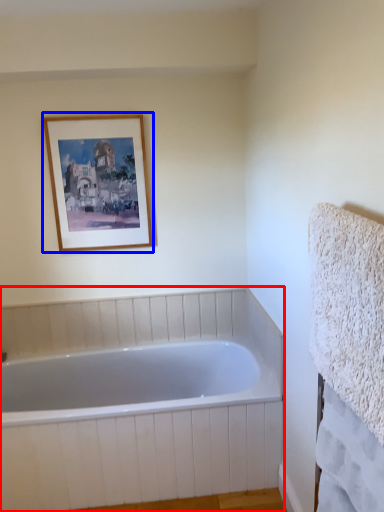
Question: Which object appears closest to the camera in this image, bathtub (highlighted by a red box) or picture frame (highlighted by a blue box)?

Choices:
 (A) bathtub
 (B) picture frame

Answer: (A)